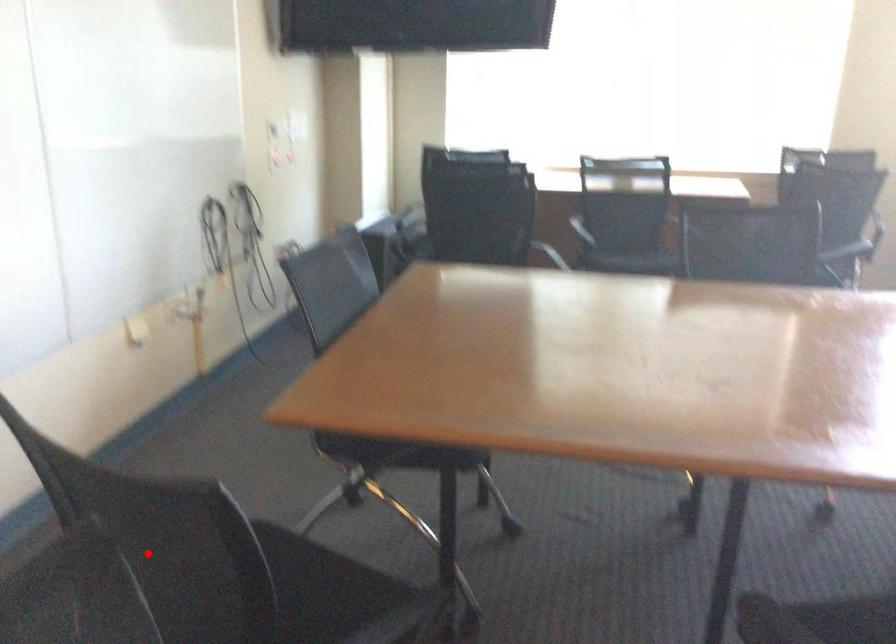
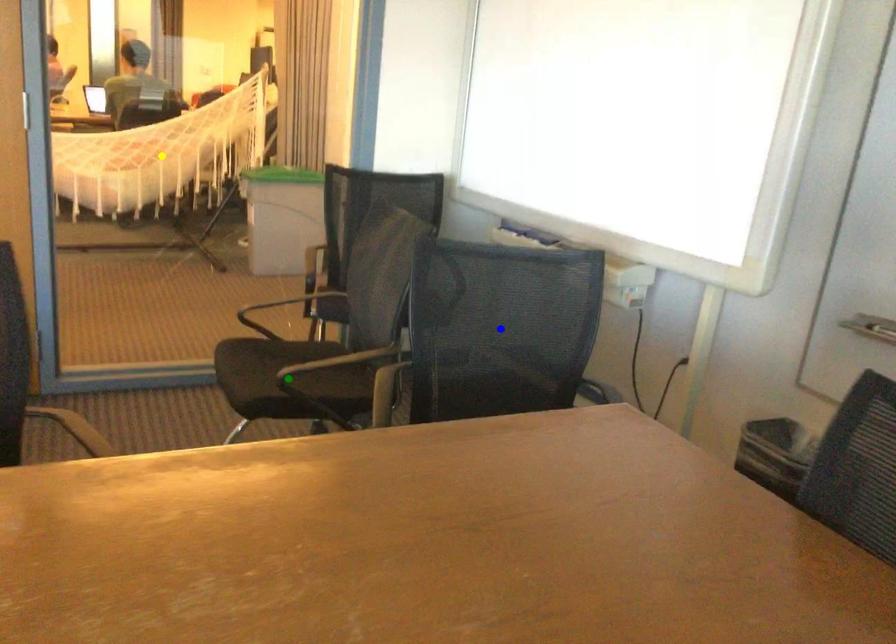
Question: I am providing you with two images of the same scene from different viewpoints. A red point is marked on the first image. You are given multiple points on the second image. Which spot in image 2 lines up with the point in image 1?

Choices:
 (A) green point
 (B) blue point
 (C) yellow point

Answer: (B)